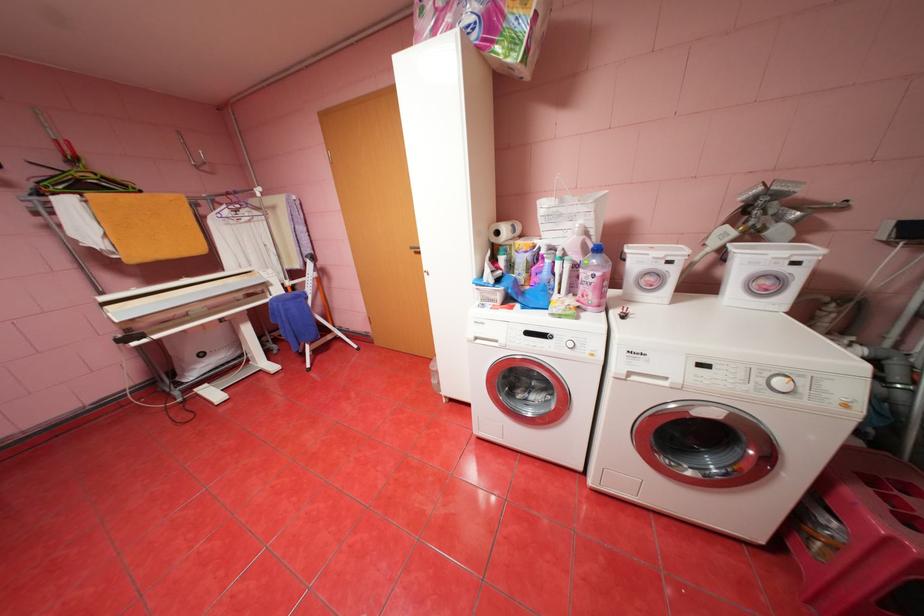
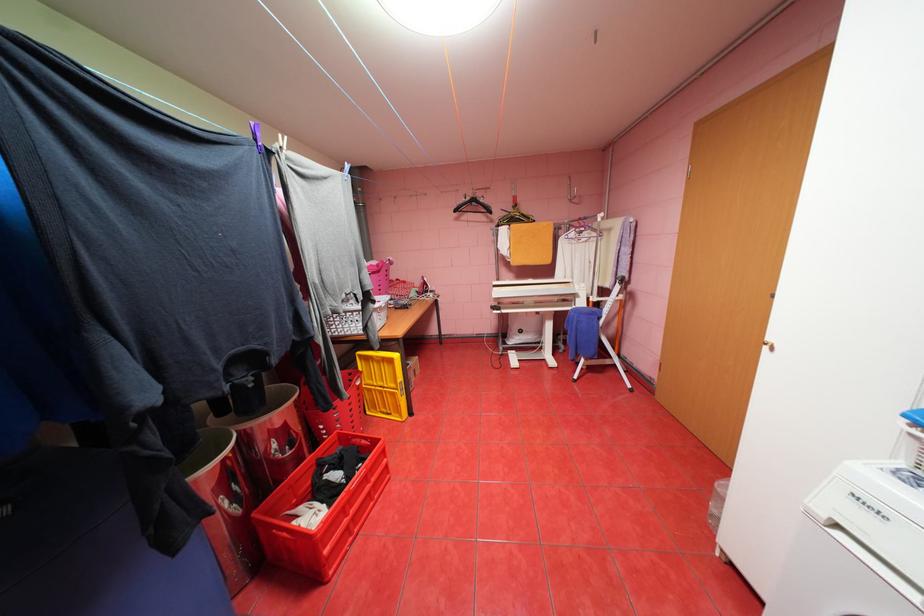
The point at (274, 284) is marked in the first image. Where is the corresponding point in the second image?

(584, 294)